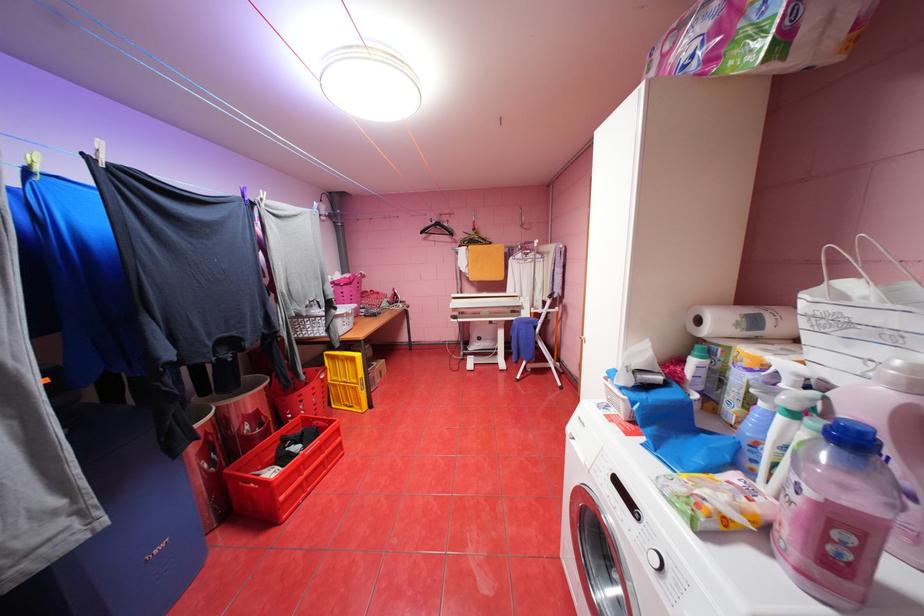
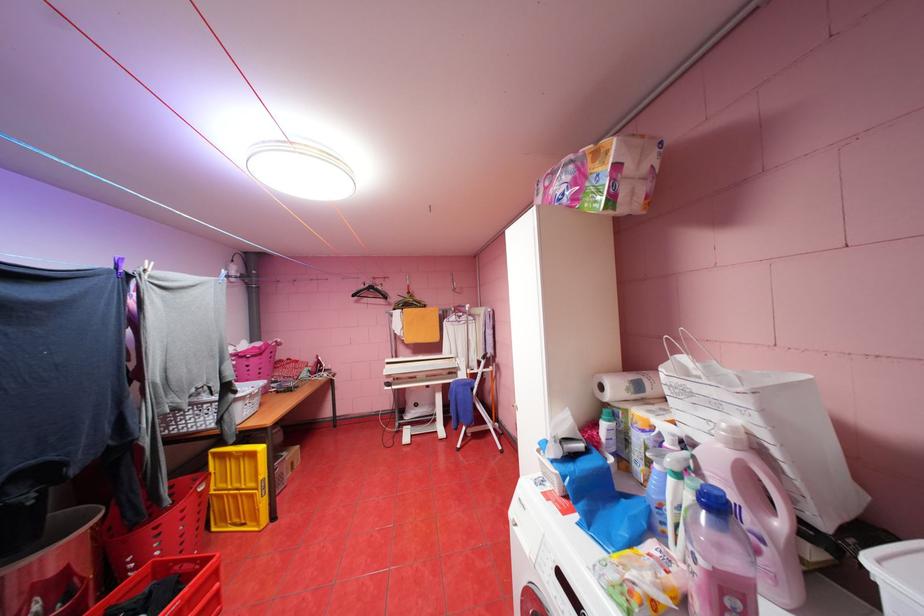
Locate, in the second image, the point that corresponds to (854,453) in the first image.

(723, 517)